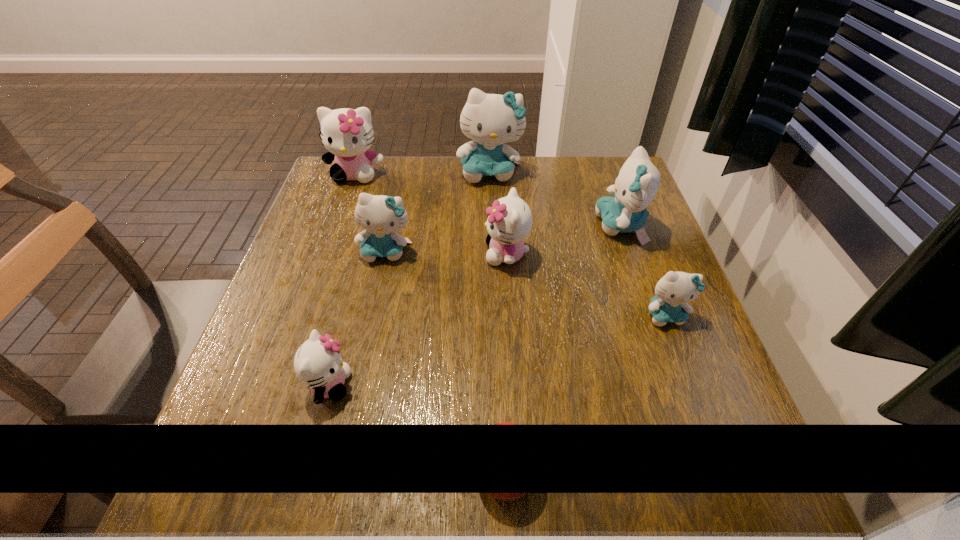
Where is `free point between the nearest white kitten and the shortest object`? free point between the nearest white kitten and the shortest object is located at coordinates (418, 427).

Locate which object is the fourth closest to the nearest object. Please provide its 2D coordinates. Your answer should be formatted as a tuple, i.e. [(x, y)], where the tuple contains the x and y coordinates of a point satisfying the conditions above.

[(381, 216)]

Identify the location of object that is the third closest to the apple. (510, 219).

Locate which kitten is the third closest to the nearest kitten. Please provide its 2D coordinates. Your answer should be formatted as a tuple, i.e. [(x, y)], where the tuple contains the x and y coordinates of a point satisfying the conditions above.

[(347, 134)]

This screenshot has height=540, width=960. Identify the location of the third closest kitten relative to the third smallest blue kitten. (491, 120).

Identify which blue kitten is the second nearest to the third smallest blue kitten. Please provide its 2D coordinates. Your answer should be formatted as a tuple, i.e. [(x, y)], where the tuple contains the x and y coordinates of a point satisfying the conditions above.

[(491, 120)]

In order to click on blue kitten that stands as the second closest to the sixth farthest kitten in this screenshot , I will do `click(491, 120)`.

Where is `white kitten that is the third closest one to the tallest kitten`? white kitten that is the third closest one to the tallest kitten is located at coordinates (318, 363).

Image resolution: width=960 pixels, height=540 pixels. Find the location of `the second closest white kitten to the leftmost blue kitten`. the second closest white kitten to the leftmost blue kitten is located at coordinates (347, 134).

What are the coordinates of `vacant space that satisfies the following two spatial constraints: 1. on the face of the tallest kitten; 2. on the right side of the red apple` in the screenshot? It's located at (498, 469).